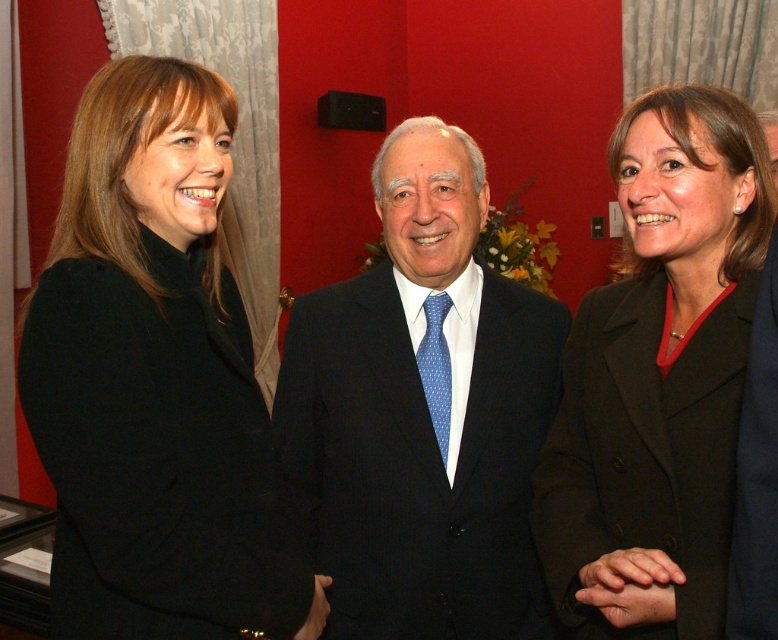
You are organizing a photo shoot and need to ensure that the black woolen coat at left and the blue dotted silk tie at center are visible in the frame. Given that the camera has a limited focus range, which object should you prioritize to ensure it fits within the frame?

The black woolen coat at left should be prioritized because its width is larger than the blue dotted silk tie at center, making it more critical to position correctly for the frame.